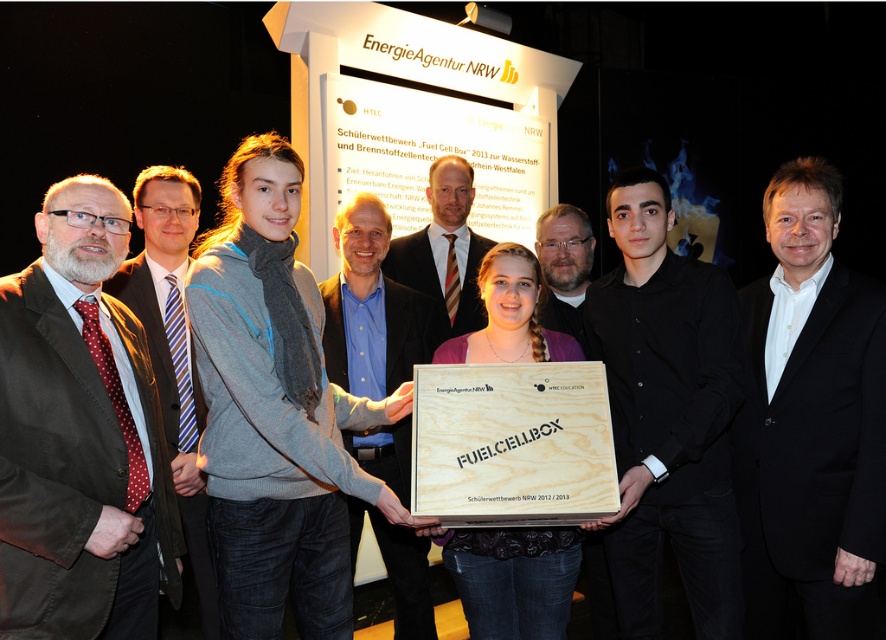
Can you confirm if wooden at center is shorter than blue shirt at center?

Indeed, wooden at center has a lesser height compared to blue shirt at center.

Identify the location of wooden at center. (511, 444).

Does black wood box at center have a larger size compared to polka dot fabric tie at left?

Indeed, black wood box at center has a larger size compared to polka dot fabric tie at left.

Which is more to the right, black wood box at center or polka dot fabric tie at left?

Positioned to the right is black wood box at center.

Between point (700, 394) and point (165, 212), which one is positioned in front?

Point (700, 394) is in front.

Locate an element on the screen. This screenshot has width=886, height=640. black wood box at center is located at coordinates (666, 416).

Does point (483, 445) lie behind point (556, 289)?

No.

Between wooden at center and matte black suit at center, which one has more height?

matte black suit at center is taller.

Which is behind, point (597, 467) or point (542, 314)?

The point (542, 314) is more distant.

You are a GUI agent. You are given a task and a screenshot of the screen. Output one action in this format:
    pyautogui.click(x=<x>, y=<y>)
    Task: Click on the wooden at center
    Image resolution: width=886 pixels, height=640 pixels.
    Given the screenshot: What is the action you would take?
    pyautogui.click(x=511, y=444)